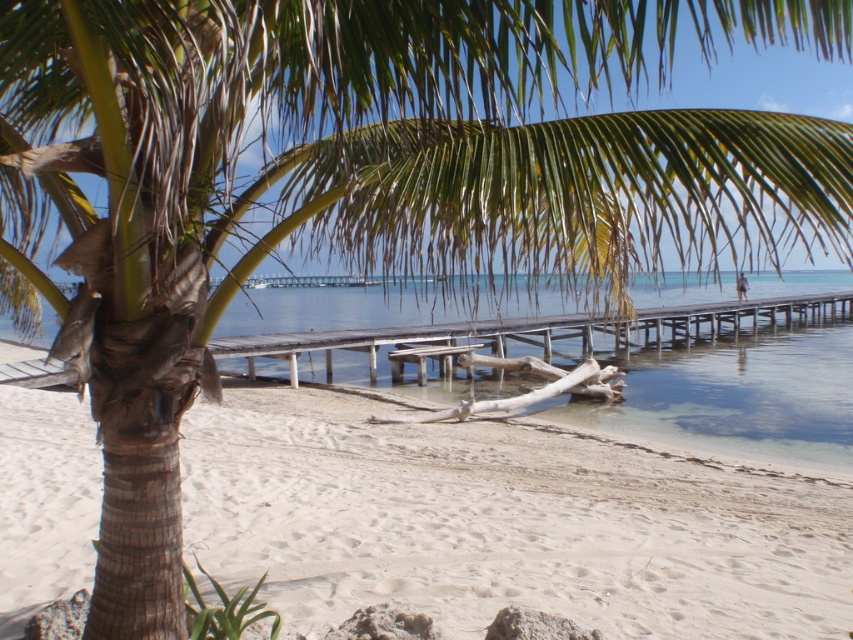
Question: Is the position of white sandy beach at lower left more distant than that of clear blue water at center?

Choices:
 (A) yes
 (B) no

Answer: (A)

Question: Does white sandy beach at lower left appear on the left side of clear blue water at center?

Choices:
 (A) yes
 (B) no

Answer: (A)

Question: Can you confirm if white sandy beach at lower left is positioned to the right of clear blue water at center?

Choices:
 (A) no
 (B) yes

Answer: (A)

Question: Among these objects, which one is nearest to the camera?

Choices:
 (A) white sandy beach at lower left
 (B) clear blue water at center

Answer: (B)